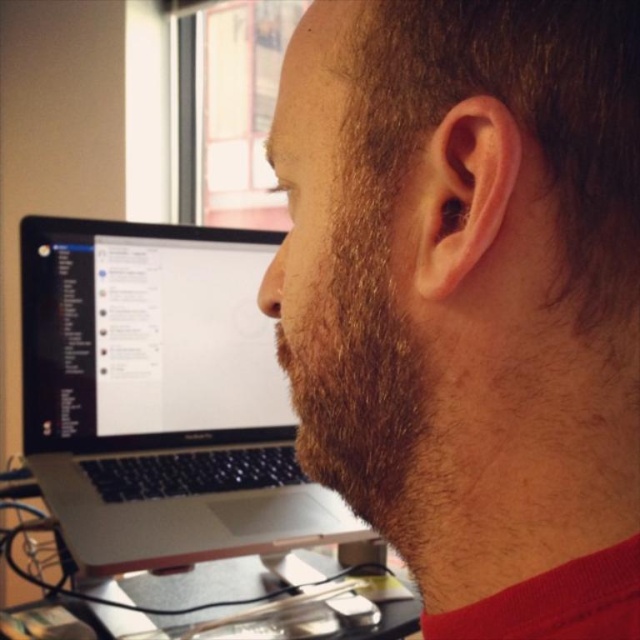
Question: Can you confirm if silver metallic laptop at left is positioned to the right of metallic silver computer desk at lower center?

Choices:
 (A) yes
 (B) no

Answer: (A)

Question: Is silver metallic laptop at left thinner than metallic silver computer desk at lower center?

Choices:
 (A) no
 (B) yes

Answer: (B)

Question: Does dark brown beard at center lie behind silver metallic laptop at left?

Choices:
 (A) no
 (B) yes

Answer: (A)

Question: Based on their relative distances, which object is farther from the silver metallic laptop at left?

Choices:
 (A) metallic silver computer desk at lower center
 (B) dark brown beard at center

Answer: (B)

Question: Considering the real-world distances, which object is closest to the metallic silver computer desk at lower center?

Choices:
 (A) dark brown beard at center
 (B) silver metallic laptop at left

Answer: (B)

Question: Which point is closer to the camera?

Choices:
 (A) (44, 355)
 (B) (561, 320)

Answer: (B)